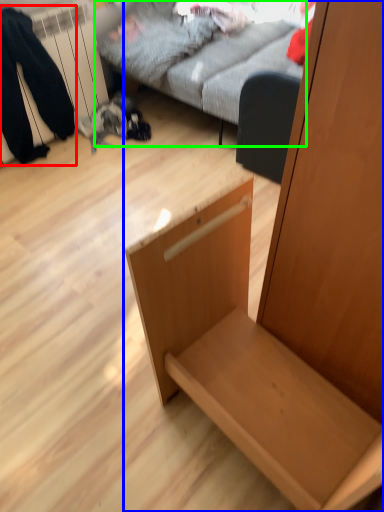
Question: Which object is the farthest from couple (highlighted by a red box)? Choose among these: furniture (highlighted by a blue box) or studio couch (highlighted by a green box).

Choices:
 (A) furniture
 (B) studio couch

Answer: (A)